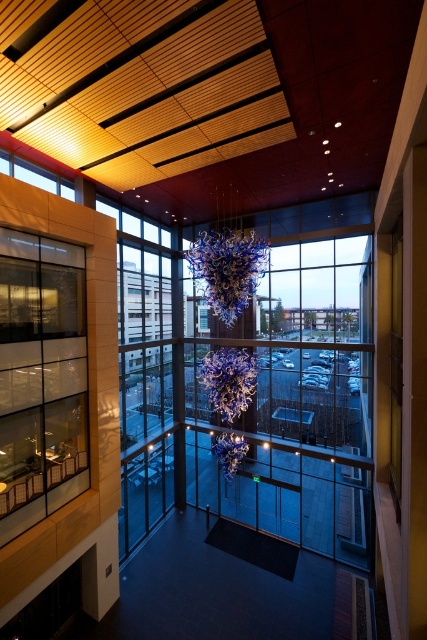
You are standing in the modern building and want to look outside through the clear glass window at left and the transparent glass window at upper left. Which window is positioned to the right side?

The clear glass window at left is positioned to the right of the transparent glass window at upper left.

You are standing in the modern building and want to know how far you are from the point marked as point (23, 246). Can you determine the distance?

The distance between you and point (23, 246) is 7.94 meters.